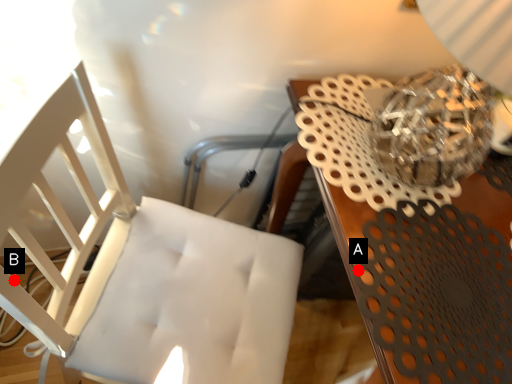
Question: Two points are circled on the image, labeled by A and B beside each circle. Which point is farther from the camera taking this photo?

Choices:
 (A) A is further
 (B) B is further

Answer: (A)